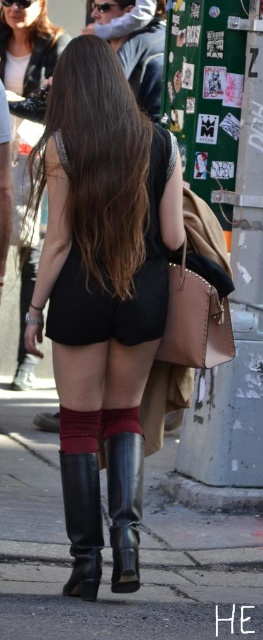
Can you confirm if matte black shorts at center is wider than black leather boot at lower center?

Yes.

Can you confirm if matte black shorts at center is positioned above black leather boot at lower center?

Yes.

Consider the image. Who is more distant from viewer, (x=73, y=340) or (x=87, y=490)?

Point (x=73, y=340)

Where is `matte black shorts at center`? matte black shorts at center is located at coordinates (102, 292).

Does black matte dress at center have a lesser height compared to matte black boots at lower center?

No.

Is point (145, 272) closer to viewer compared to point (27, 376)?

Yes, it is in front of point (27, 376).

Does point (149, 212) lie in front of point (24, 140)?

Yes, point (149, 212) is in front of point (24, 140).

Locate an element on the screen. This screenshot has width=263, height=640. black matte dress at center is located at coordinates (110, 284).

Can you confirm if black matte dress at center is taller than shiny black leather boot at lower center?

Indeed, black matte dress at center has a greater height compared to shiny black leather boot at lower center.

Is point (98, 305) positioned in front of point (122, 520)?

No, it is behind (122, 520).

The height and width of the screenshot is (640, 263). Describe the element at coordinates (110, 284) in the screenshot. I see `black matte dress at center` at that location.

The width and height of the screenshot is (263, 640). In order to click on black matte dress at center in this screenshot , I will do `click(110, 284)`.